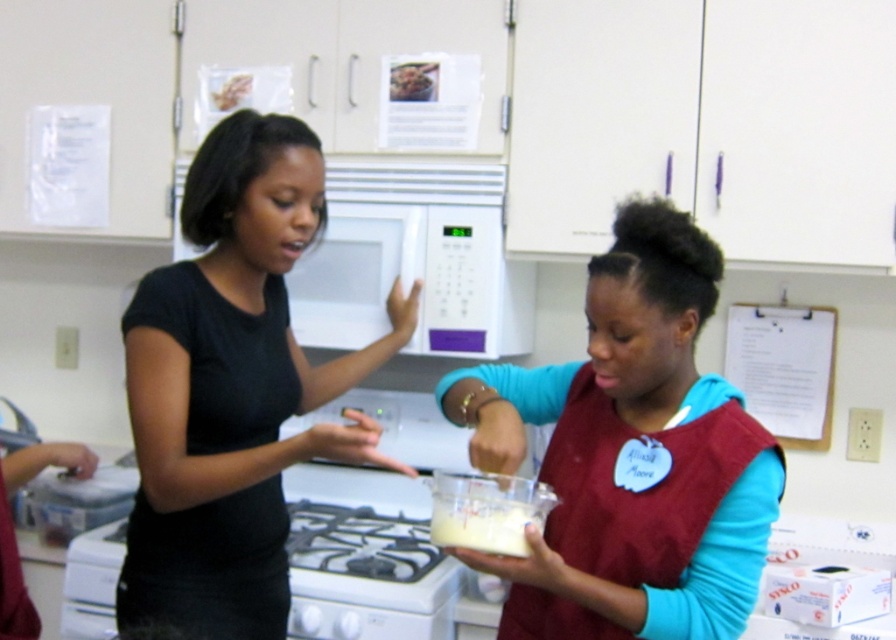
You are a fashion designer observing the kitchen scene. You need to determine which garment has a narrower width between the maroon fabric apron at center and the black matte shirt at center. Which one should you choose for your next collection if you want a more fitted look?

The maroon fabric apron at center has a narrower width than the black matte shirt at center, so it would be suitable for a more fitted look.

In the scene shown: Please describe the exact position of the maroon fabric apron at center in the kitchen scene using the coordinate system provided. What are its coordinates?

The maroon fabric apron at center is located at the coordinates point (631, 454).

You are a chef preparing a recipe and need to determine which item is larger between the white glossy stove at lower center and the white opaque liquid at center. Based on the scene, which one is bigger?

The white glossy stove at lower center is bigger than the white opaque liquid at center according to the description.